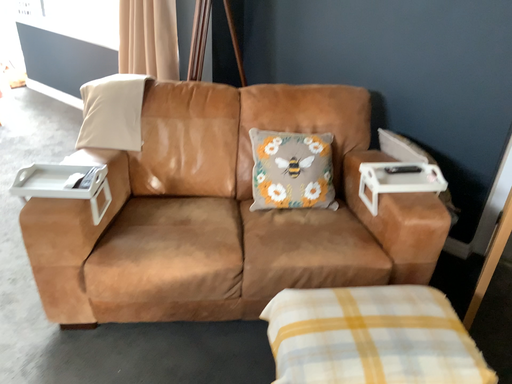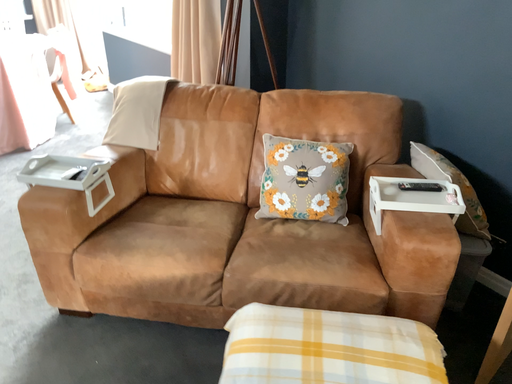
Question: How did the camera likely rotate when shooting the video?

Choices:
 (A) rotated left
 (B) rotated right

Answer: (A)